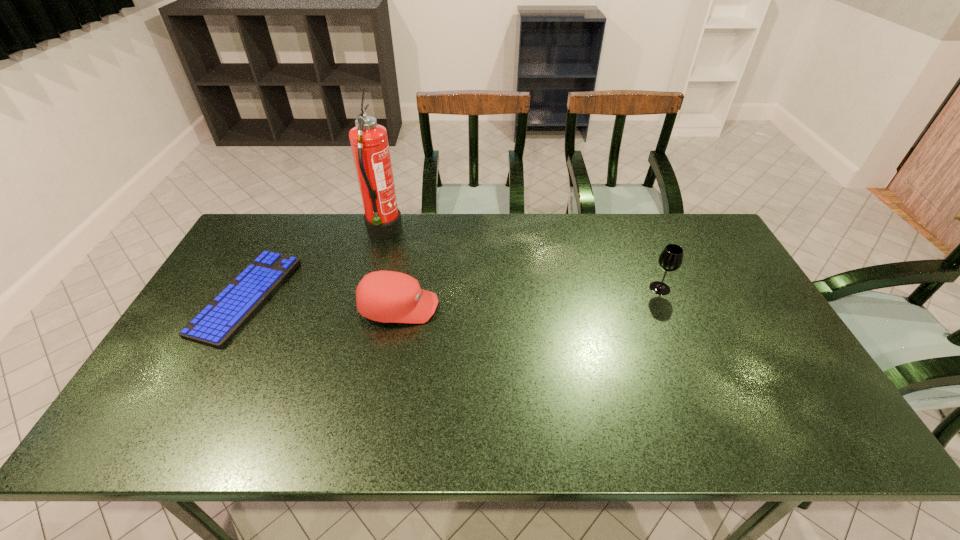
Choose which object is the nearest neighbor to the tallest object. Please provide its 2D coordinates. Your answer should be formatted as a tuple, i.e. [(x, y)], where the tuple contains the x and y coordinates of a point satisfying the conditions above.

[(385, 296)]

Where is `free spot that satisfies the following two spatial constraints: 1. on the back side of the computer keyboard; 2. on the left side of the second tallest object`? The image size is (960, 540). free spot that satisfies the following two spatial constraints: 1. on the back side of the computer keyboard; 2. on the left side of the second tallest object is located at coordinates (251, 288).